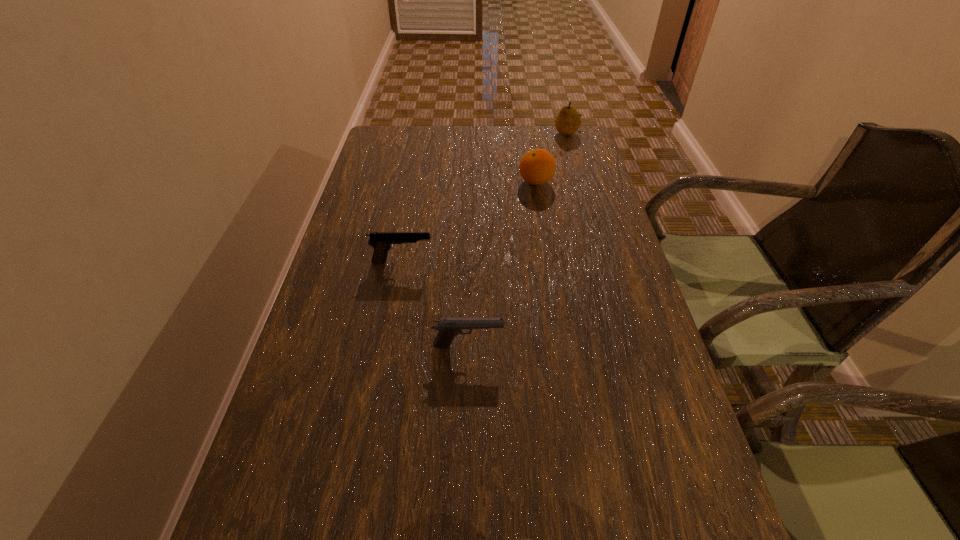
Where is `the farthest object`? This screenshot has height=540, width=960. the farthest object is located at coordinates click(567, 122).

Identify the location of the rightmost object. (567, 122).

Locate an element on the screen. This screenshot has width=960, height=540. the second farthest object is located at coordinates (537, 167).

You are a GUI agent. You are given a task and a screenshot of the screen. Output one action in this format:
    pyautogui.click(x=<x>, y=<y>)
    Task: Click on the farther pistol
    The image size is (960, 540).
    Given the screenshot: What is the action you would take?
    pyautogui.click(x=382, y=242)

Where is `the leftmost object`? The width and height of the screenshot is (960, 540). the leftmost object is located at coordinates (382, 242).

Where is `the right pistol`? The image size is (960, 540). the right pistol is located at coordinates (448, 328).

Locate an element on the screen. The height and width of the screenshot is (540, 960). the fourth farthest object is located at coordinates (448, 328).

The width and height of the screenshot is (960, 540). I want to click on vacant region located on the front of the rightmost object, so click(x=583, y=185).

Locate an element on the screen. The height and width of the screenshot is (540, 960). vacant space located 0.330m on the left of the second farthest object is located at coordinates (410, 182).

The image size is (960, 540). Identify the location of vacant space situated 0.050m at the muzzle of the leftmost object. (453, 261).